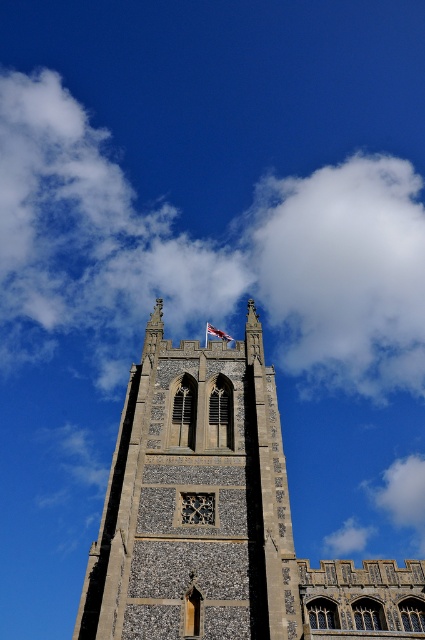
Measure the distance between point [376,276] and camera.

Point [376,276] is 846.17 feet away from camera.

Is white fluffy cloud at upper center bigger than red fabric flag at center?

Yes, white fluffy cloud at upper center is bigger than red fabric flag at center.

Is point (339, 196) closer to camera compared to point (207, 324)?

That is False.

This screenshot has height=640, width=425. I want to click on white fluffy cloud at upper center, so click(x=342, y=272).

Which is more to the left, stone tower at center or red fabric flag at center?

stone tower at center

Between point (240, 435) and point (206, 326), which one is positioned in front?

Point (240, 435) is in front.

Is point (257, 531) in front of point (231, 339)?

Yes, point (257, 531) is closer to viewer.

Find the location of `stone tower at center`. stone tower at center is located at coordinates (195, 500).

Is point (217, 442) behind point (373, 308)?

No, it is in front of (373, 308).

Can you confirm if stone tower at center is positioned to the right of white fluffy cloud at upper center?

In fact, stone tower at center is to the left of white fluffy cloud at upper center.

Where is `stone tower at center`? Image resolution: width=425 pixels, height=640 pixels. stone tower at center is located at coordinates (195, 500).

At what (x,y) coordinates should I click in order to perform the action: click on stone tower at center. Please return your answer as a coordinate pair (x, y). This screenshot has height=640, width=425. Looking at the image, I should click on (195, 500).